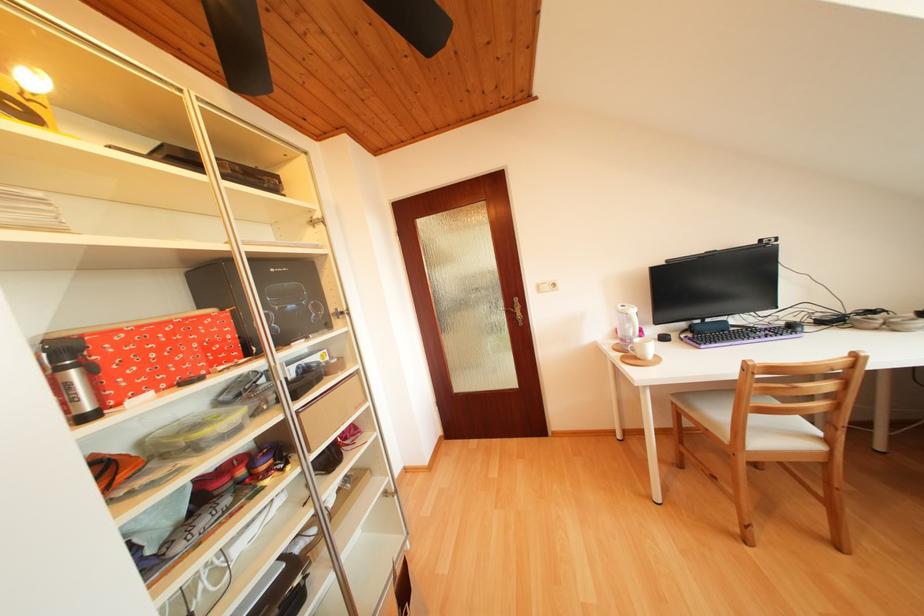
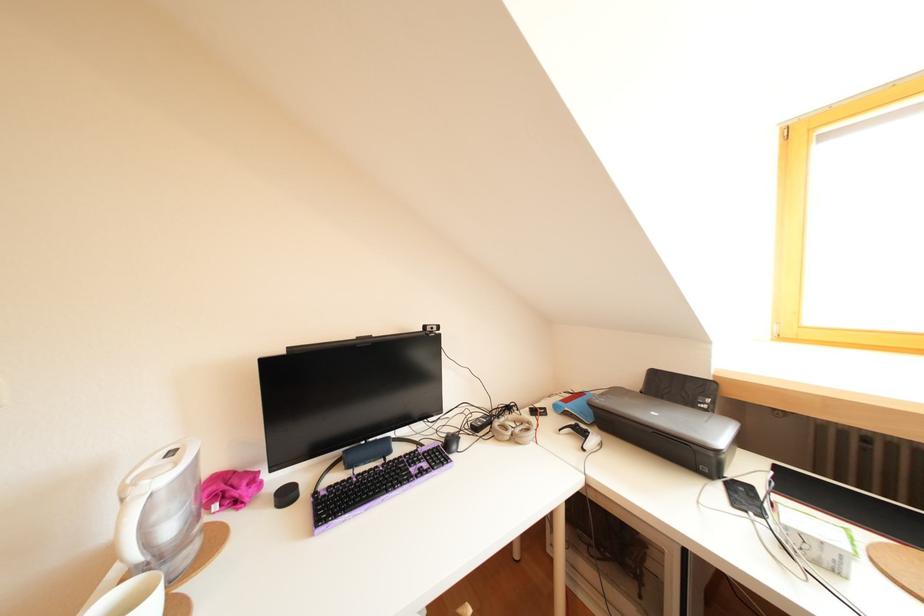
In the second image, find the point that corresponds to the point at 880,317 in the first image.

(516, 413)